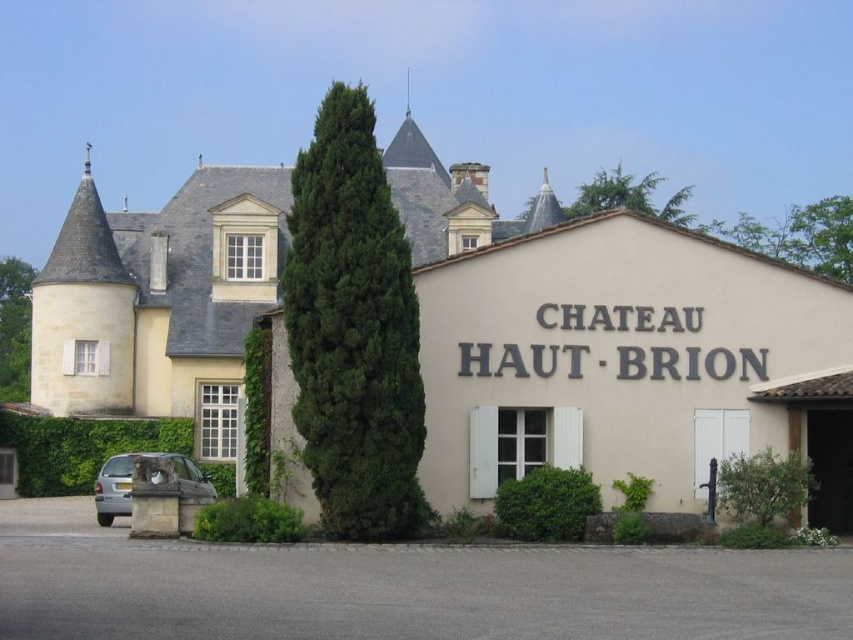
Is point (235, 300) closer to viewer compared to point (102, 474)?

No, (235, 300) is further to viewer.

Can you confirm if beige stone building at center is taller than silver metallic car at lower left?

Yes.

Identify the location of beige stone building at center. (160, 301).